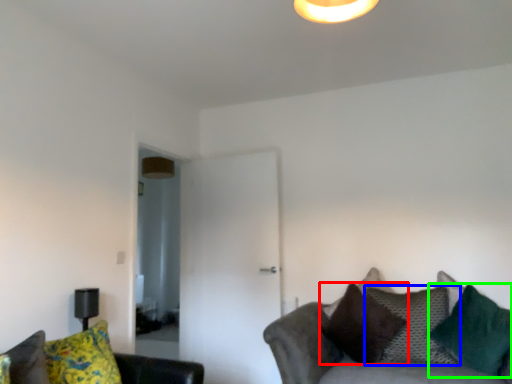
Question: Which object is positioned farthest from pillow (highlighted by a red box)? Select from pillow (highlighted by a blue box) and pillow (highlighted by a green box).

Choices:
 (A) pillow
 (B) pillow

Answer: (B)